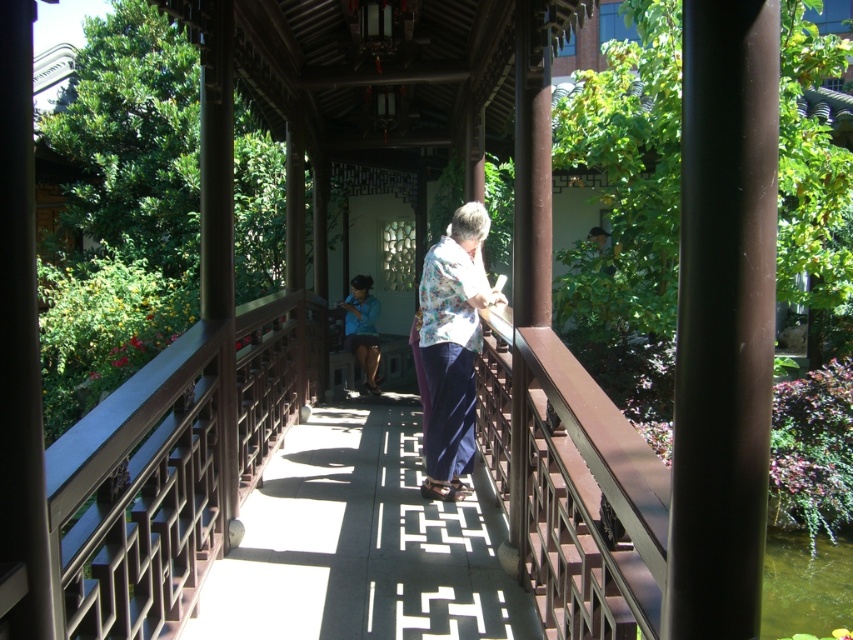
Question: Which point is farther to the camera?

Choices:
 (A) brown wooden bridge at center
 (B) floral fabric shirt at center

Answer: (B)

Question: Is the position of floral fabric shirt at center more distant than that of blue fabric shirt at center?

Choices:
 (A) yes
 (B) no

Answer: (B)

Question: Which of the following is the farthest from the observer?

Choices:
 (A) (354, 346)
 (B) (550, 381)

Answer: (A)

Question: Considering the real-world distances, which object is closest to the floral fabric shirt at center?

Choices:
 (A) brown wooden bridge at center
 (B) blue fabric shirt at center

Answer: (A)

Question: Can you confirm if brown wooden bridge at center is smaller than floral fabric shirt at center?

Choices:
 (A) no
 (B) yes

Answer: (B)

Question: Is the position of brown wooden bridge at center more distant than that of floral fabric shirt at center?

Choices:
 (A) no
 (B) yes

Answer: (A)